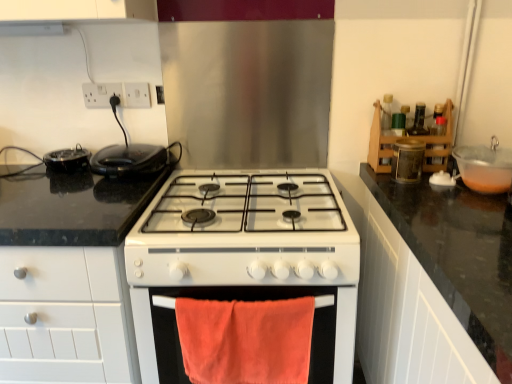
At what (x,y) coordinates should I click in order to perform the action: click on unoccupied area in front of black glossy waffle maker at left, which is the 1th kitchen appliance in right-to-left order. Please return your answer as a coordinate pair (x, y). The height and width of the screenshot is (384, 512). Looking at the image, I should click on (115, 197).